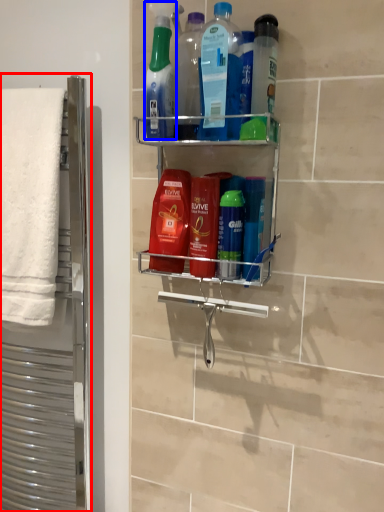
Question: Among these objects, which one is nearest to the camera, screen door (highlighted by a red box) or cleaning product (highlighted by a blue box)?

Choices:
 (A) screen door
 (B) cleaning product

Answer: (B)